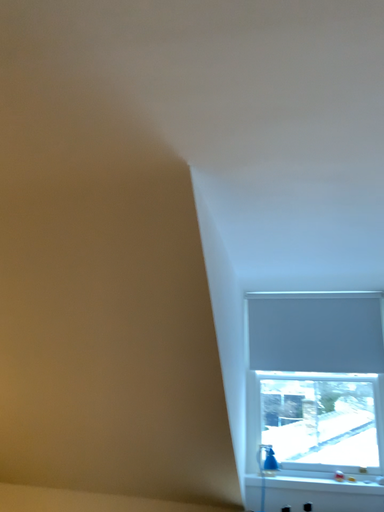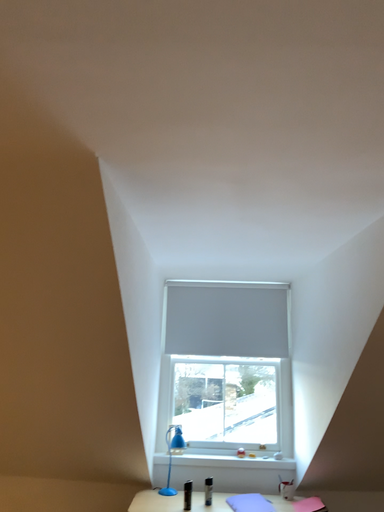
Question: How did the camera likely rotate when shooting the video?

Choices:
 (A) rotated right
 (B) rotated left

Answer: (A)